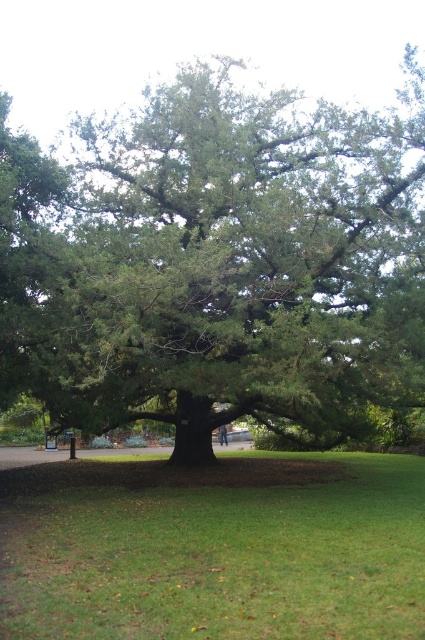
You are planning to place a picnic blanket in the area shown in the image. Considering the green leafy tree at center and the green grass at center, which area would provide more space for the blanket without overlapping the tree?

The green grass at center has a smaller width than the green leafy tree at center, so placing the picnic blanket on the green grass at center would provide more space without overlapping the tree.

You are standing in a park and see the green leafy tree at center and the green grass at center. Which object would you need to look up to see properly?

The green leafy tree at center requires looking up to see properly because it is much taller than the green grass at center.

You are standing at the origin point in the image. Which direction should you move to reach the green leafy tree at center?

The green leafy tree at center is located at point 0.414 on the x and 0.515 on the y axis. Since you are at the origin, you should move towards the right and slightly upwards to reach it.